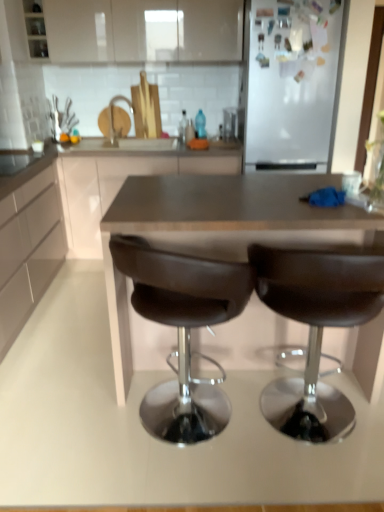
You are a GUI agent. You are given a task and a screenshot of the screen. Output one action in this format:
    pyautogui.click(x=<x>, y=<y>)
    Task: Click on the free space above brown leather table at center (from a real-world perspective)
    The width and height of the screenshot is (384, 512).
    Given the screenshot: What is the action you would take?
    pyautogui.click(x=224, y=194)